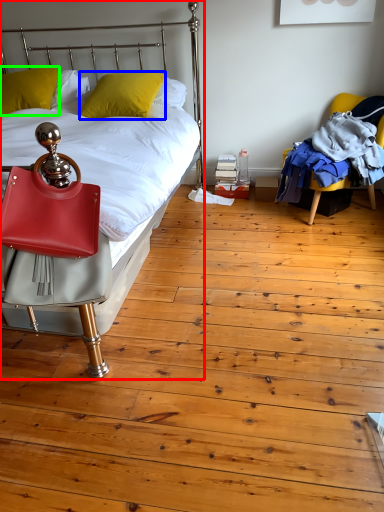
Question: Which object is positioned farthest from bed (highlighted by a red box)? Select from pillow (highlighted by a blue box) and pillow (highlighted by a green box).

Choices:
 (A) pillow
 (B) pillow

Answer: (B)